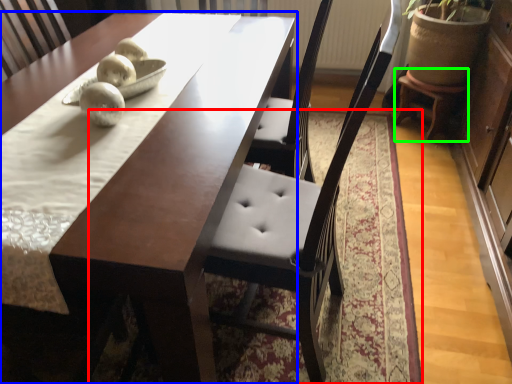
Question: Based on their relative distances, which object is farther from mat (highlighted by a red box)? Choose from table (highlighted by a blue box) and stool (highlighted by a green box).

Choices:
 (A) table
 (B) stool

Answer: (B)